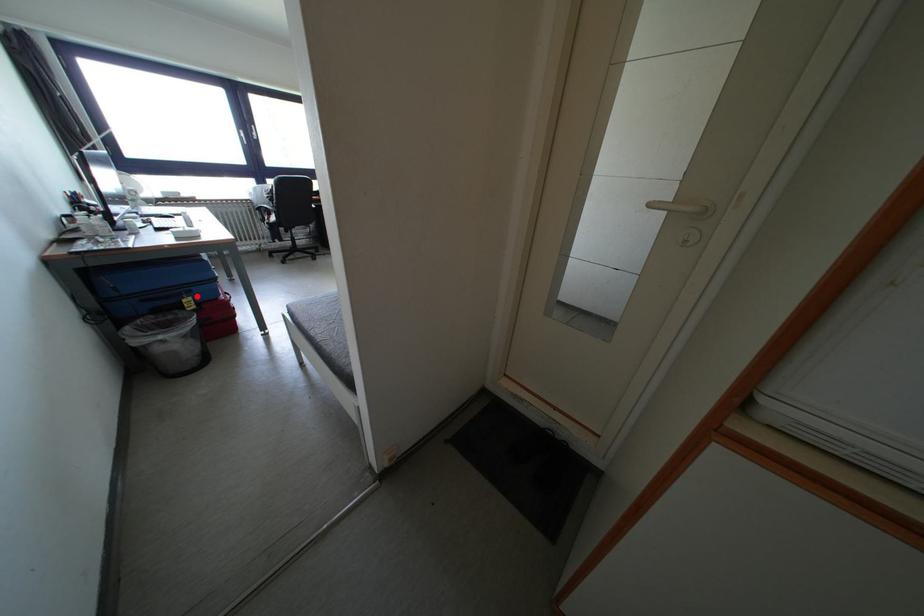
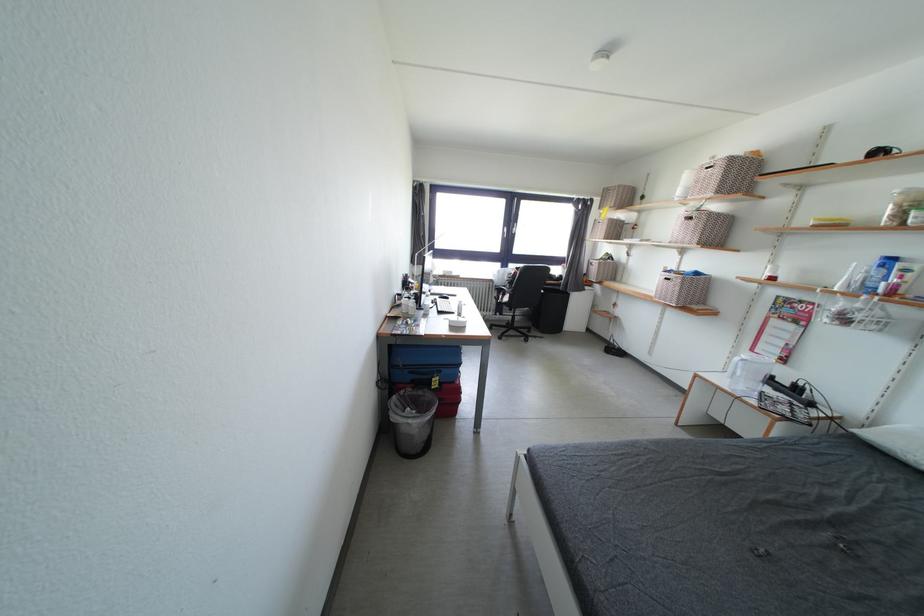
Question: A red point is marked in image1. In image2, is the corresponding 3D point closer to the camera or farther? Reply with the corresponding letter.

Choices:
 (A) The corresponding 3D point is closer.
 (B) The corresponding 3D point is farther.

Answer: (B)